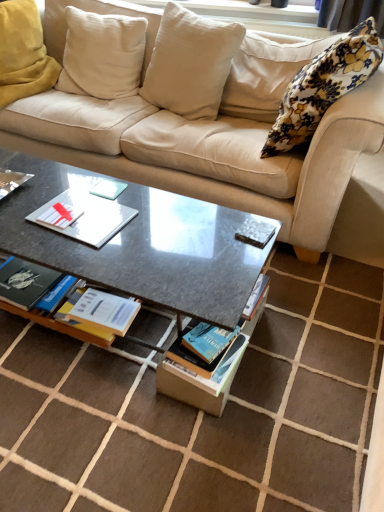
At what (x,y) coordinates should I click in order to perform the action: click on free point to the right of white matte paper at center. Please return your answer as a coordinate pair (x, y). Looking at the image, I should click on (151, 224).